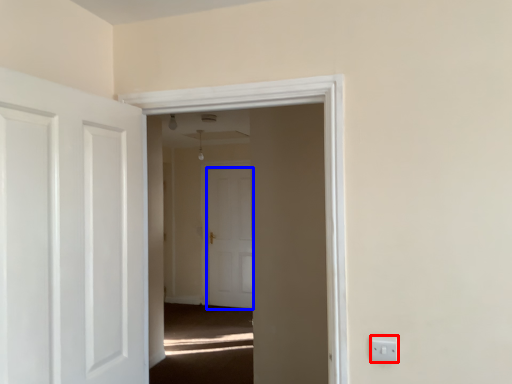
Question: Which object is closer to the camera taking this photo, electric outlet (highlighted by a red box) or door (highlighted by a blue box)?

Choices:
 (A) electric outlet
 (B) door

Answer: (A)